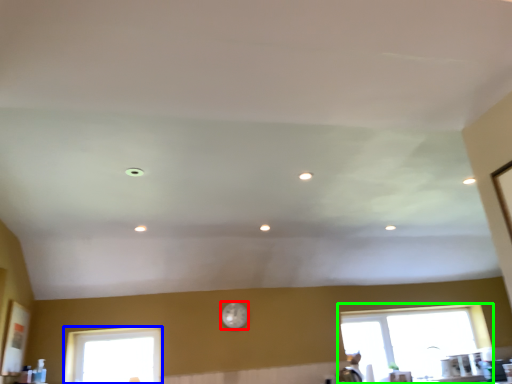
Question: Which is nearer to the clock (highlighted by a red box)? window (highlighted by a blue box) or window (highlighted by a green box).

Choices:
 (A) window
 (B) window

Answer: (A)